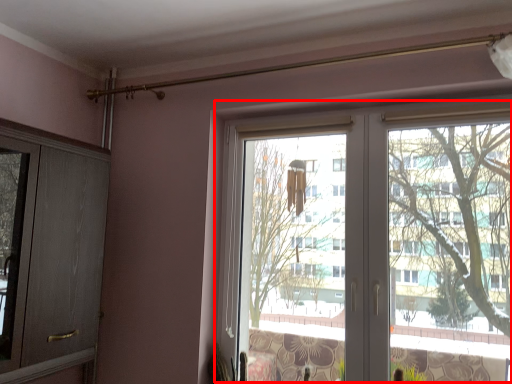
Question: From the image's perspective, what is the correct spatial positioning of bay window (annotated by the red box) in reference to screen door?

Choices:
 (A) below
 (B) above

Answer: (A)